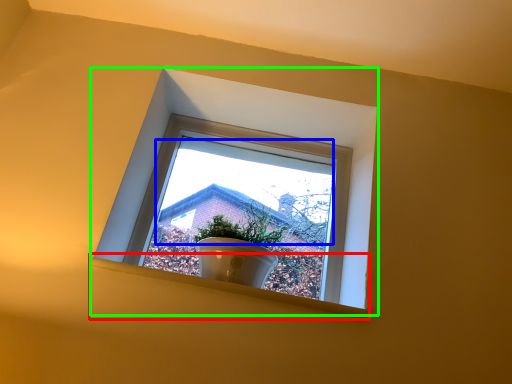
Question: Which object is the farthest from window sill (highlighted by a red box)? Choose among these: morning light (highlighted by a blue box) or window (highlighted by a green box).

Choices:
 (A) morning light
 (B) window

Answer: (A)